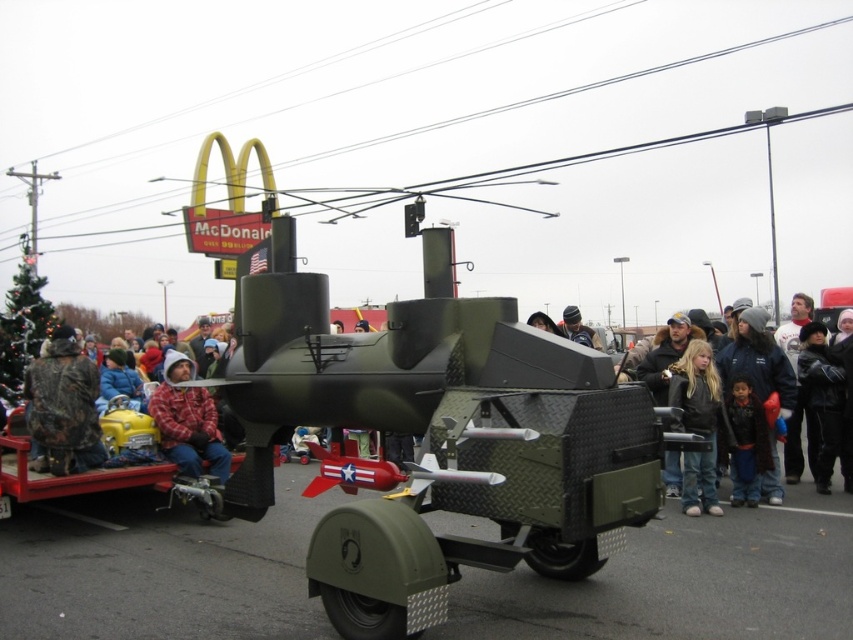
Looking at this image, is black fleece jacket at lower right bigger than dark green military vehicle at center?

Incorrect, black fleece jacket at lower right is not larger than dark green military vehicle at center.

Between black fleece jacket at lower right and dark green military vehicle at center, which one appears on the left side from the viewer's perspective?

From the viewer's perspective, dark green military vehicle at center appears more on the left side.

Where is `black fleece jacket at lower right`? black fleece jacket at lower right is located at coordinates (747, 442).

Is point (746, 413) farther from camera compared to point (585, 330)?

No, (746, 413) is in front of (585, 330).

Between point (734, 424) and point (593, 337), which one is positioned in front?

Point (734, 424) is more forward.

Identify the location of black fleece jacket at lower right. (747, 442).

Is point (756, 451) positioned behind point (787, 438)?

No, (756, 451) is in front of (787, 438).

In the scene shown: Does black fleece jacket at lower right appear on the right side of black leather jacket at center?

In fact, black fleece jacket at lower right is to the left of black leather jacket at center.

What do you see at coordinates (747, 442) in the screenshot?
I see `black fleece jacket at lower right` at bounding box center [747, 442].

Identify the location of black fleece jacket at lower right. (747, 442).